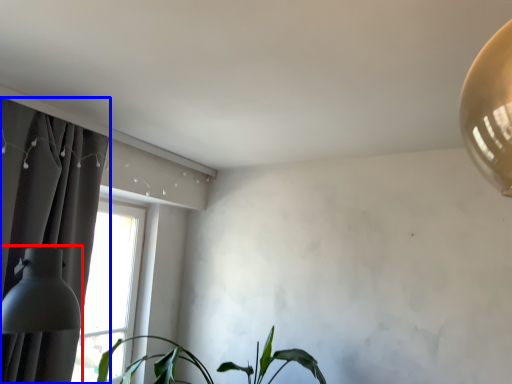
Question: Which object appears farthest to the camera in this image, table lamp (highlighted by a red box) or curtain (highlighted by a blue box)?

Choices:
 (A) table lamp
 (B) curtain

Answer: (B)